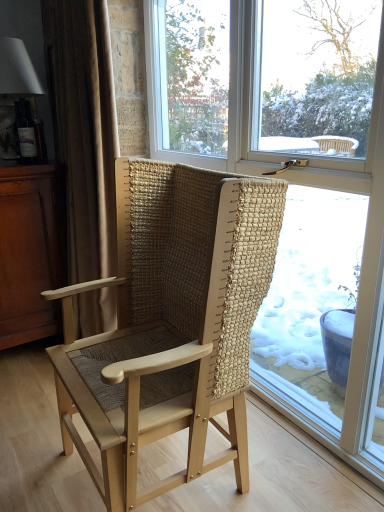
Question: Does dark brown wood dresser at left turn towards beige fabric curtain at left?

Choices:
 (A) no
 (B) yes

Answer: (A)

Question: Considering the relative positions of dark brown wood dresser at left and beige fabric curtain at left in the image provided, is dark brown wood dresser at left to the right of beige fabric curtain at left from the viewer's perspective?

Choices:
 (A) yes
 (B) no

Answer: (B)

Question: Can you confirm if dark brown wood dresser at left is wider than beige fabric curtain at left?

Choices:
 (A) yes
 (B) no

Answer: (A)

Question: Considering the relative positions of dark brown wood dresser at left and beige fabric curtain at left in the image provided, is dark brown wood dresser at left behind beige fabric curtain at left?

Choices:
 (A) no
 (B) yes

Answer: (B)

Question: From the image's perspective, would you say dark brown wood dresser at left is positioned over beige fabric curtain at left?

Choices:
 (A) yes
 (B) no

Answer: (B)

Question: From a real-world perspective, is natural woven wood chair at center physically located above or below dark brown wood dresser at left?

Choices:
 (A) below
 (B) above

Answer: (B)

Question: In terms of width, does natural woven wood chair at center look wider or thinner when compared to dark brown wood dresser at left?

Choices:
 (A) thin
 (B) wide

Answer: (A)

Question: Considering their positions, is natural woven wood chair at center located in front of or behind dark brown wood dresser at left?

Choices:
 (A) behind
 (B) front

Answer: (B)

Question: From the image's perspective, relative to dark brown wood dresser at left, is natural woven wood chair at center above or below?

Choices:
 (A) below
 (B) above

Answer: (A)

Question: Looking at the image, does matte white lampshade at upper left seem bigger or smaller compared to natural woven wood chair at center?

Choices:
 (A) big
 (B) small

Answer: (B)

Question: Is matte white lampshade at upper left taller or shorter than natural woven wood chair at center?

Choices:
 (A) short
 (B) tall

Answer: (A)

Question: Is point (16, 80) closer or farther from the camera than point (142, 402)?

Choices:
 (A) farther
 (B) closer

Answer: (A)

Question: Considering the positions of matte white lampshade at upper left and natural woven wood chair at center in the image, is matte white lampshade at upper left wider or thinner than natural woven wood chair at center?

Choices:
 (A) thin
 (B) wide

Answer: (A)

Question: Considering the positions of point (16, 195) and point (350, 409), is point (16, 195) closer or farther from the camera than point (350, 409)?

Choices:
 (A) farther
 (B) closer

Answer: (A)

Question: Which is correct: dark brown wood dresser at left is inside transparent glass window at center, or outside of it?

Choices:
 (A) inside
 (B) outside

Answer: (B)